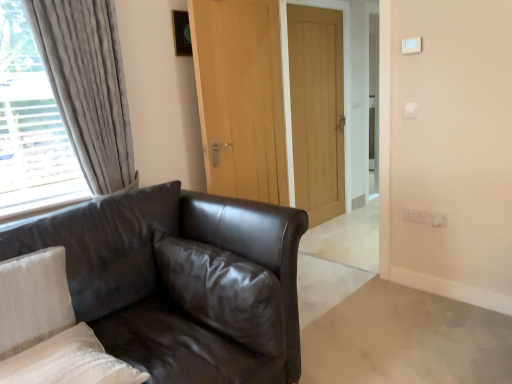
Measure the distance between point [37,259] and camera.

Point [37,259] is 5.02 feet away from camera.

This screenshot has height=384, width=512. What do you see at coordinates (241, 97) in the screenshot?
I see `wooden door at center, which is counted as the second door, starting from the back` at bounding box center [241, 97].

Image resolution: width=512 pixels, height=384 pixels. Identify the location of matte black leather couch at left. (181, 281).

Where is `glossy leather pillow at center, acting as the 1th pillow starting from the right`? The width and height of the screenshot is (512, 384). glossy leather pillow at center, acting as the 1th pillow starting from the right is located at coordinates (224, 292).

Is white textured pillow at lower left, marked as the second pillow in a right-to-left arrangement, facing towards white plastic light switch at upper right, which is the 1th light switch from back to front?

No.

Which is correct: white textured pillow at lower left, the second pillow positioned from the left, is inside white plastic light switch at upper right, which ranks as the 2th light switch in front-to-back order, or outside of it?

white textured pillow at lower left, the second pillow positioned from the left, is located beyond the bounds of white plastic light switch at upper right, which ranks as the 2th light switch in front-to-back order.

Image resolution: width=512 pixels, height=384 pixels. What are the coordinates of `the 3rd pillow positioned below the white plastic light switch at upper right, arranged as the second light switch when viewed from the top (from a real-world perspective)` in the screenshot? It's located at [x=69, y=362].

Considering the sizes of objects velvet grey curtain at left and light brown wooden door at center, positioned as the first door in right-to-left order, in the image provided, who is shorter, velvet grey curtain at left or light brown wooden door at center, positioned as the first door in right-to-left order,?

With less height is velvet grey curtain at left.

Does velvet grey curtain at left have a smaller size compared to light brown wooden door at center, the first door from the back?

No.

There is a velvet grey curtain at left. Identify the location of the 2nd door above it (from the image's perspective). click(x=317, y=110).

From a real-world perspective, is velvet grey curtain at left positioned above or below light brown wooden door at center, positioned as the first door in right-to-left order?

From a real-world perspective, velvet grey curtain at left is physically above light brown wooden door at center, positioned as the first door in right-to-left order.

Is white plastic electric outlet at lower right, positioned as the 1th electric outlet in front-to-back order, closer to camera compared to white plastic light switch at upper right, which is counted as the first light switch, starting from the front?

No, white plastic electric outlet at lower right, positioned as the 1th electric outlet in front-to-back order, is further to the viewer.

Is white plastic electric outlet at lower right, which appears as the second electric outlet when viewed from the left, taller or shorter than white plastic light switch at upper right, which is counted as the first light switch, starting from the front?

white plastic electric outlet at lower right, which appears as the second electric outlet when viewed from the left, is taller than white plastic light switch at upper right, which is counted as the first light switch, starting from the front.

Could you tell me if white plastic electric outlet at lower right, which appears as the second electric outlet when viewed from the left, is facing white plastic light switch at upper right, the second light switch when ordered from bottom to top?

No, white plastic electric outlet at lower right, which appears as the second electric outlet when viewed from the left, does not turn towards white plastic light switch at upper right, the second light switch when ordered from bottom to top.

From the image's perspective, would you say matte black leather couch at left is positioned over velvet grey curtain at left?

No, from the image's perspective, matte black leather couch at left is not on top of velvet grey curtain at left.

Locate an element on the screen. curtain behind the matte black leather couch at left is located at coordinates (87, 85).

Is matte black leather couch at left inside the boundaries of velvet grey curtain at left, or outside?

matte black leather couch at left is not enclosed by velvet grey curtain at left.

Does matte black leather couch at left have a lesser width compared to velvet grey curtain at left?

No.

From the image's perspective, which one is positioned lower, white plastic electric outlet at lower right, the first electric outlet positioned from the left, or velvet grey curtain at left?

white plastic electric outlet at lower right, the first electric outlet positioned from the left, is shown below in the image.

From a real-world perspective, starting from the velvet grey curtain at left, which electric outlet is the 2nd one below it? Please provide its 2D coordinates.

[(415, 215)]

How many degrees apart are the facing directions of white plastic electric outlet at lower right, the first electric outlet positioned from the left, and velvet grey curtain at left?

The angle between the facing direction of white plastic electric outlet at lower right, the first electric outlet positioned from the left, and the facing direction of velvet grey curtain at left is 90.3 degrees.

Which of these two, white plastic electric outlet at lower right, the first electric outlet positioned from the left, or velvet grey curtain at left, stands shorter?

With less height is white plastic electric outlet at lower right, the first electric outlet positioned from the left.

Which is closer, (418, 43) or (328, 130)?

Point (418, 43) is closer to the camera than point (328, 130).

Choose the correct answer: Is white plastic light switch at upper right, which is counted as the first light switch, starting from the front, inside light brown wooden door at center, the first door from the back, or outside it?

white plastic light switch at upper right, which is counted as the first light switch, starting from the front, lies outside light brown wooden door at center, the first door from the back.

Is white plastic light switch at upper right, which is the first light switch from top to bottom, facing towards light brown wooden door at center, which is the 2th door from left to right?

No, white plastic light switch at upper right, which is the first light switch from top to bottom, is not turned towards light brown wooden door at center, which is the 2th door from left to right.

Considering the relative sizes of white textured pillow at lower left, which is the 3th pillow from right to left, and wooden door at center, which ranks as the second door in right-to-left order, in the image provided, is white textured pillow at lower left, which is the 3th pillow from right to left, taller than wooden door at center, which ranks as the second door in right-to-left order,?

No, white textured pillow at lower left, which is the 3th pillow from right to left, is not taller than wooden door at center, which ranks as the second door in right-to-left order.

From a real-world perspective, is white textured pillow at lower left, which is the 3th pillow from right to left, located beneath wooden door at center, which is counted as the first door, starting from the front?

Yes, from a real-world perspective, white textured pillow at lower left, which is the 3th pillow from right to left, is beneath wooden door at center, which is counted as the first door, starting from the front.

Considering the points (58, 289) and (277, 164), which point is behind, point (58, 289) or point (277, 164)?

The point (277, 164) is behind.

Which is more to the right, white textured pillow at lower left, acting as the first pillow starting from the left, or wooden door at center, which ranks as the second door in right-to-left order?

From the viewer's perspective, wooden door at center, which ranks as the second door in right-to-left order, appears more on the right side.

Where is `the 3rd pillow in front of the white plastic light switch at upper right, arranged as the second light switch when viewed from the top`? The width and height of the screenshot is (512, 384). the 3rd pillow in front of the white plastic light switch at upper right, arranged as the second light switch when viewed from the top is located at coordinates (69, 362).

You are a GUI agent. You are given a task and a screenshot of the screen. Output one action in this format:
    pyautogui.click(x=<x>, y=<y>)
    Task: Click on the curtain below the light brown wooden door at center, which is the 2th door from left to right (from the image's perspective)
    The height and width of the screenshot is (384, 512).
    Given the screenshot: What is the action you would take?
    pyautogui.click(x=87, y=85)

From the image, which object appears to be farther from matte black leather couch at left, white textured pillow at lower left, which is the 3th pillow from right to left, or light brown wooden door at center, the first door from the back?

Based on the image, light brown wooden door at center, the first door from the back, appears to be further to matte black leather couch at left.

Estimate the real-world distances between objects in this image. Which object is further from wooden door at center, which ranks as the second door in right-to-left order, white textured pillow at lower left, which is the 3th pillow from right to left, or velvet grey curtain at left?

white textured pillow at lower left, which is the 3th pillow from right to left, is positioned further to the anchor wooden door at center, which ranks as the second door in right-to-left order.

When comparing their distances from white plastic electric outlet at lower right, the first electric outlet positioned from the left, does glossy leather pillow at center, acting as the 1th pillow starting from the right, or white plastic electric outlet at lower right, which appears as the second electric outlet when viewed from the left, seem further?

Among the two, glossy leather pillow at center, acting as the 1th pillow starting from the right, is located further to white plastic electric outlet at lower right, the first electric outlet positioned from the left.

Which object lies nearer to the anchor point glossy leather pillow at center, acting as the 1th pillow starting from the right, white plastic electric outlet at lower right, which appears as the second electric outlet when viewed from the left, or matte black leather couch at left?

The object closer to glossy leather pillow at center, acting as the 1th pillow starting from the right, is matte black leather couch at left.

When comparing their distances from light brown wooden door at center, the first door from the back, does wooden door at center, which ranks as the second door in right-to-left order, or velvet grey curtain at left seem closer?

wooden door at center, which ranks as the second door in right-to-left order, lies closer to light brown wooden door at center, the first door from the back, than the other object.

Looking at the image, which one is located further to white plastic electric outlet at lower right, which appears as the second electric outlet when viewed from the left, white textured pillow at lower left, which is the 3th pillow from right to left, or matte black leather couch at left?

The object further to white plastic electric outlet at lower right, which appears as the second electric outlet when viewed from the left, is white textured pillow at lower left, which is the 3th pillow from right to left.

When comparing their distances from velvet grey curtain at left, does matte black leather couch at left or white textured pillow at lower left, the second pillow positioned from the left, seem further?

white textured pillow at lower left, the second pillow positioned from the left, is further to velvet grey curtain at left.

Based on their spatial positions, is matte black leather couch at left or wooden door at center, which is counted as the first door, starting from the front, closer to white plastic electric outlet at lower right, which appears as the second electric outlet when viewed from the left?

wooden door at center, which is counted as the first door, starting from the front, is closer to white plastic electric outlet at lower right, which appears as the second electric outlet when viewed from the left.

Locate an element on the screen. door positioned between white textured pillow at lower left, marked as the second pillow in a right-to-left arrangement, and white plastic electric outlet at lower right, which appears as the 2th electric outlet when viewed from the front, from near to far is located at coordinates (241, 97).

Locate an element on the screen. curtain between wooden door at center, which ranks as the second door in right-to-left order, and glossy leather pillow at center, positioned as the 3th pillow in left-to-right order, vertically is located at coordinates (87, 85).

This screenshot has width=512, height=384. I want to click on electric outlet between white textured pillow at lower left, marked as the second pillow in a right-to-left arrangement, and white plastic electric outlet at lower right, positioned as the second electric outlet in back-to-front order, in the horizontal direction, so click(x=415, y=215).

Locate an element on the screen. The width and height of the screenshot is (512, 384). studio couch located between white textured pillow at lower left, acting as the first pillow starting from the left, and white plastic light switch at upper right, arranged as the 2th light switch when viewed from the back, in the left-right direction is located at coordinates (181, 281).